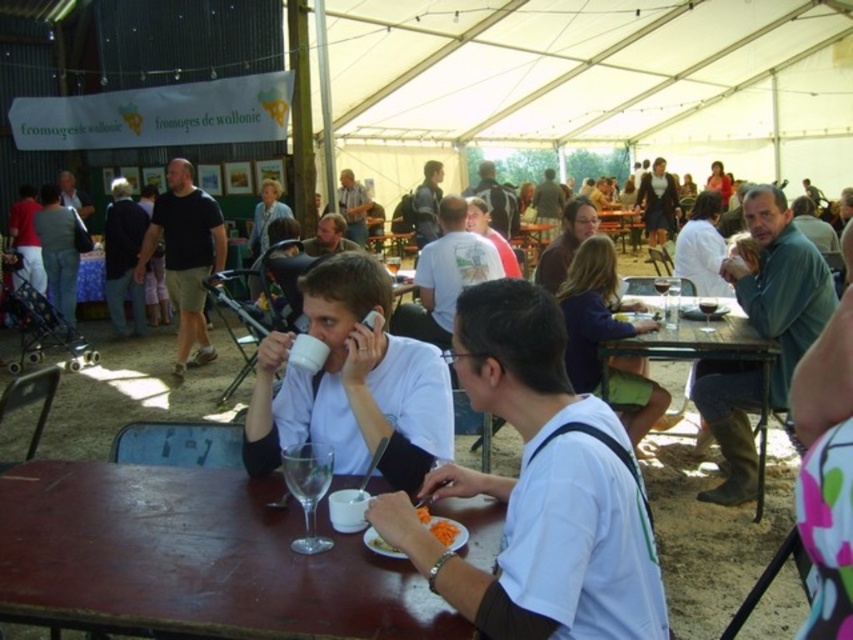
Which is above, clear glass wine at table center or dark gray backpack at center?

dark gray backpack at center is higher up.

Which of these two, clear glass wine at table center or dark gray backpack at center, stands taller?

With more height is dark gray backpack at center.

Does point (312, 493) lie in front of point (419, 195)?

Yes, point (312, 493) is closer to viewer.

The image size is (853, 640). Identify the location of clear glass wine at table center. pos(306,477).

Between green cotton shirt at right and matte gray shirt at center, which one is positioned lower?

green cotton shirt at right is lower down.

Does point (756, 474) come in front of point (349, 216)?

Yes, it is.

Image resolution: width=853 pixels, height=640 pixels. I want to click on green cotton shirt at right, so click(x=780, y=284).

Between green cotton shirt at right and matte white shirt at center, which one is positioned higher?

matte white shirt at center is higher up.

Is point (816, 262) positioned before point (480, 193)?

Yes, point (816, 262) is in front of point (480, 193).

Image resolution: width=853 pixels, height=640 pixels. In order to click on green cotton shirt at right in this screenshot , I will do `click(780, 284)`.